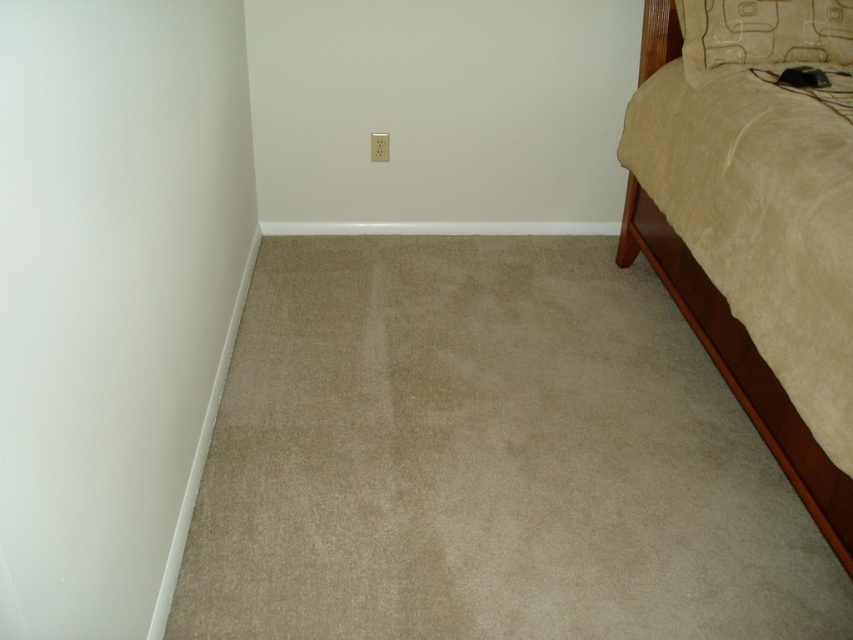
Is beige suede bed at right above beige fabric pillow at upper right?

No, beige suede bed at right is not above beige fabric pillow at upper right.

Measure the distance between beige suede bed at right and camera.

beige suede bed at right is 1.31 meters from camera.

Find the location of a particular element. The width and height of the screenshot is (853, 640). beige suede bed at right is located at coordinates (740, 369).